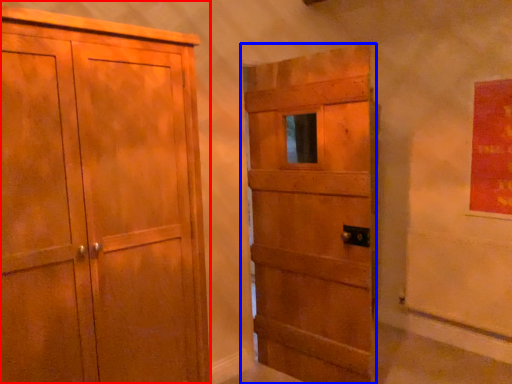
Question: Among these objects, which one is farthest to the camera, cupboard (highlighted by a red box) or door (highlighted by a blue box)?

Choices:
 (A) cupboard
 (B) door

Answer: (B)